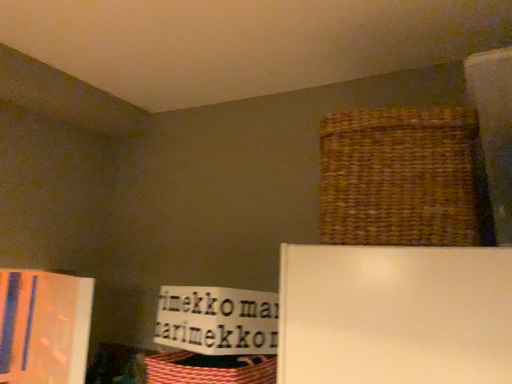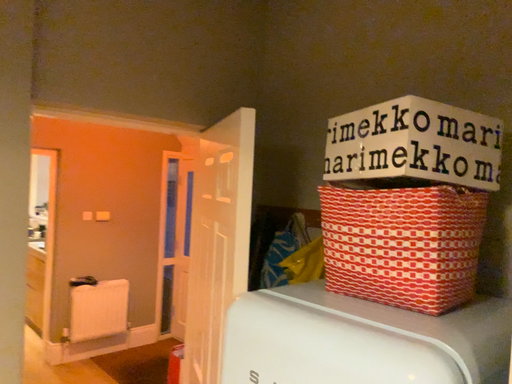
Question: Which way did the camera rotate in the video?

Choices:
 (A) rotated upward
 (B) rotated downward

Answer: (B)